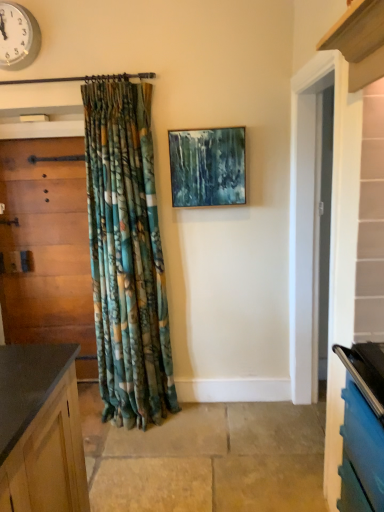
Question: Considering their positions, is teal acrylic painting at center located in front of or behind wooden door at left?

Choices:
 (A) behind
 (B) front

Answer: (B)

Question: Considering the positions of teal acrylic painting at center and wooden door at left in the image, is teal acrylic painting at center wider or thinner than wooden door at left?

Choices:
 (A) thin
 (B) wide

Answer: (A)

Question: Estimate the real-world distances between objects in this image. Which object is closer to the wooden door at left?

Choices:
 (A) teal acrylic painting at center
 (B) metallic clock at upper left

Answer: (B)

Question: Based on their relative distances, which object is farther from the teal acrylic painting at center?

Choices:
 (A) metallic clock at upper left
 (B) wooden door at left

Answer: (A)